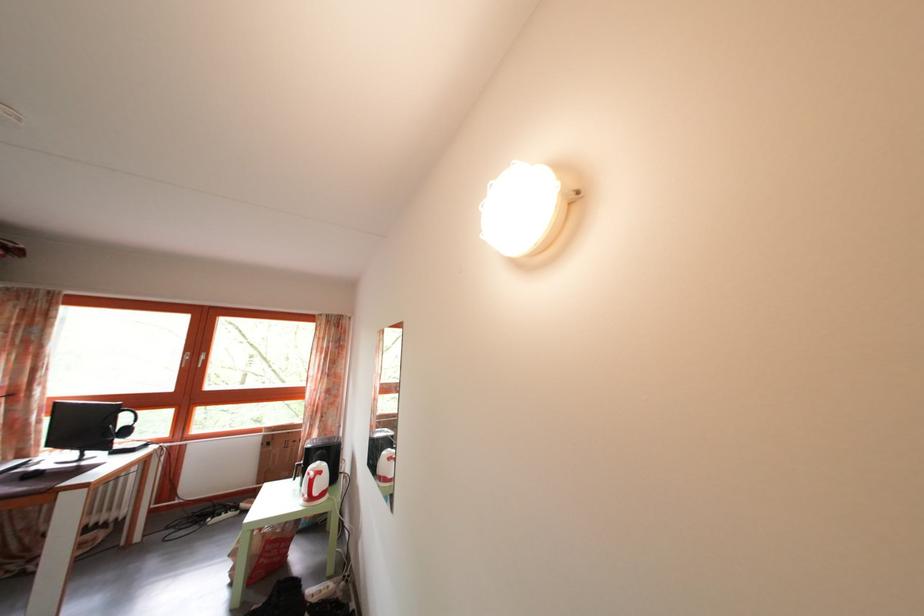
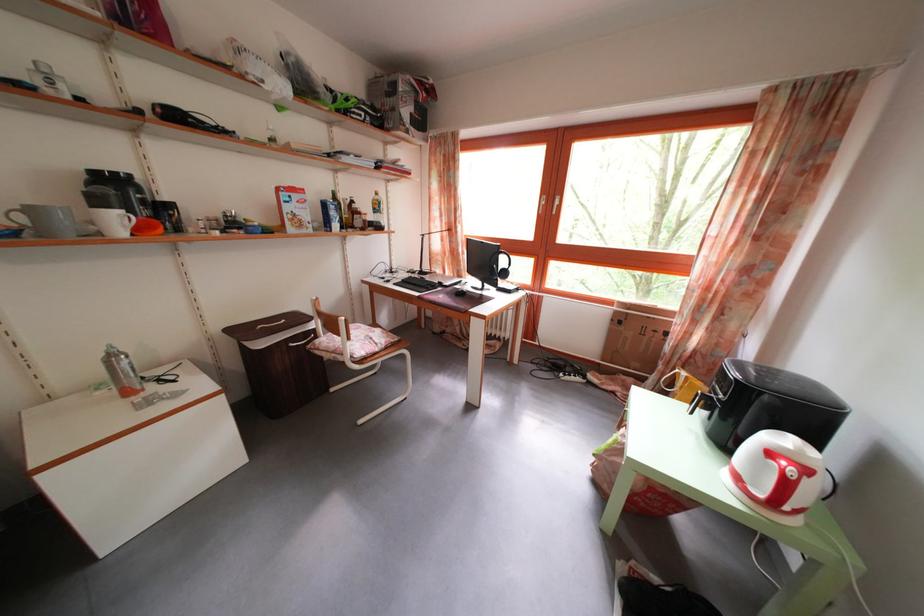
The point at (x=327, y=480) is marked in the first image. Where is the corresponding point in the second image?

(812, 477)